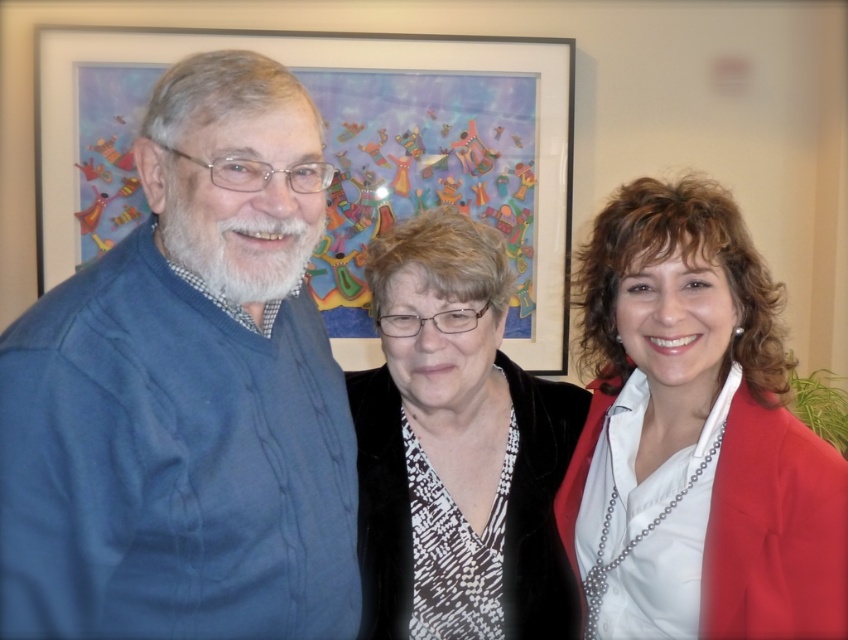
Based on the scene description, which object is positioned to the left of the other between the corduroy sweater at left and the velvet black jacket at center?

The corduroy sweater at left is positioned to the left of the velvet black jacket at center.

Based on the scene description, which object is taller between the corduroy sweater at left and the velvet black jacket at center?

The corduroy sweater at left is taller than the velvet black jacket at center.